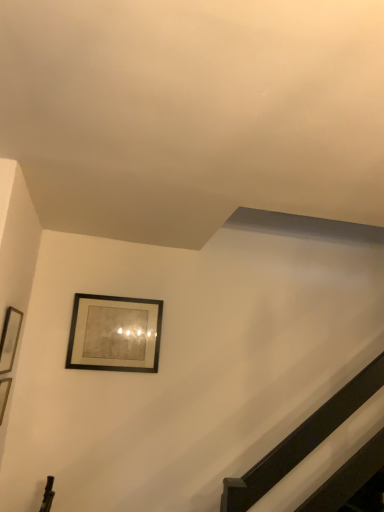
Question: Choose the correct answer: Is matte black picture frame at left, the 1th picture frame from the left, inside matte black picture frame at upper center, the second picture frame positioned from the front, or outside it?

Choices:
 (A) inside
 (B) outside

Answer: (B)

Question: Is matte black picture frame at left, which appears as the 2th picture frame when viewed from the back, to the left or to the right of matte black picture frame at upper center, the second picture frame positioned from the front, in the image?

Choices:
 (A) right
 (B) left

Answer: (B)

Question: From their relative heights in the image, would you say matte black picture frame at left, the 1th picture frame from the left, is taller or shorter than matte black picture frame at upper center, the second picture frame positioned from the front?

Choices:
 (A) tall
 (B) short

Answer: (B)

Question: Is matte black picture frame at upper center, the second picture frame in the left-to-right sequence, to the left or to the right of matte black picture frame at left, the 1th picture frame from the left, in the image?

Choices:
 (A) right
 (B) left

Answer: (A)

Question: Is point (137, 318) closer or farther from the camera than point (13, 321)?

Choices:
 (A) closer
 (B) farther

Answer: (B)

Question: Would you say matte black picture frame at upper center, the second picture frame positioned from the front, is inside or outside matte black picture frame at left, the 1th picture frame from the left?

Choices:
 (A) outside
 (B) inside

Answer: (A)

Question: Considering their positions, is matte black picture frame at upper center, arranged as the first picture frame when viewed from the back, located in front of or behind matte black picture frame at left, the 1th picture frame in the front-to-back sequence?

Choices:
 (A) behind
 (B) front

Answer: (A)